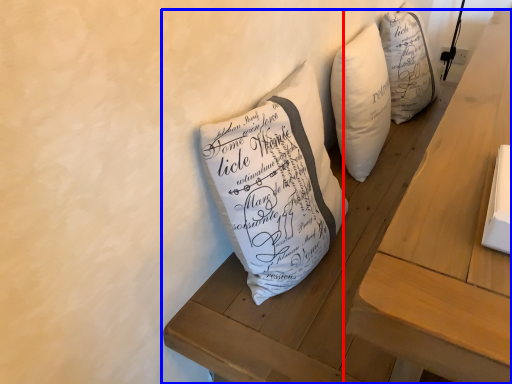
Question: Among these objects, which one is nearest to the camera, table (highlighted by a red box) or furniture (highlighted by a blue box)?

Choices:
 (A) table
 (B) furniture

Answer: (A)